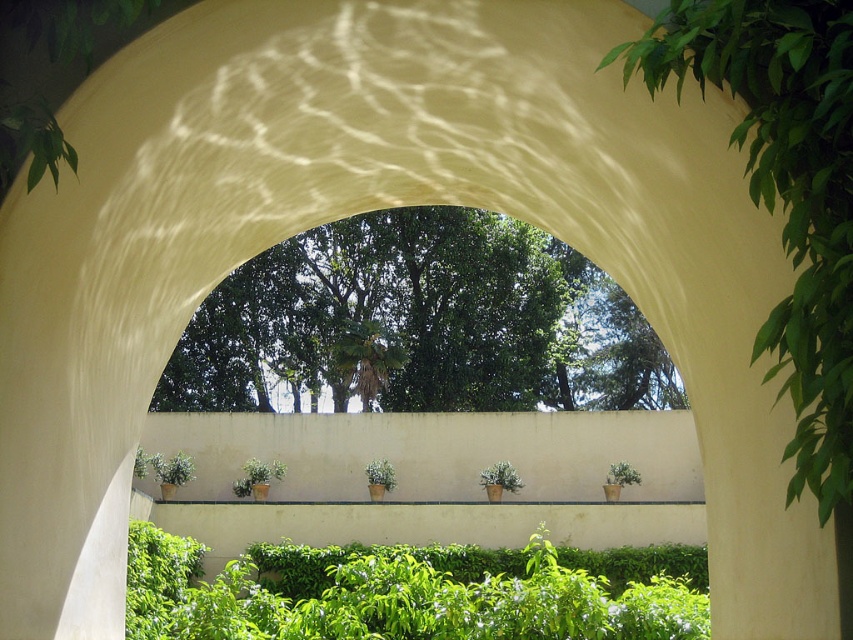
You are a gardener planning to trim both the green leafy hedge at center and the green leafy tree at right. Based on their widths, which one do you think requires more time to trim?

The green leafy hedge at center might be wider than the green leafy tree at right, so it might require more time to trim.

You are standing in front of the archway and want to walk through to the garden. Which object, the green leafy hedge at center or the green matte plant at center, will block your path first?

The green leafy hedge at center is in front of the green matte plant at center, so the green leafy hedge at center will block your path first.

You are standing in front of the archway and want to know which object is closer to you between the green leafy tree at center and the green leafy hedge at center. Which one is closer?

The green leafy tree at center is closer to you because the green leafy hedge at center is behind it.